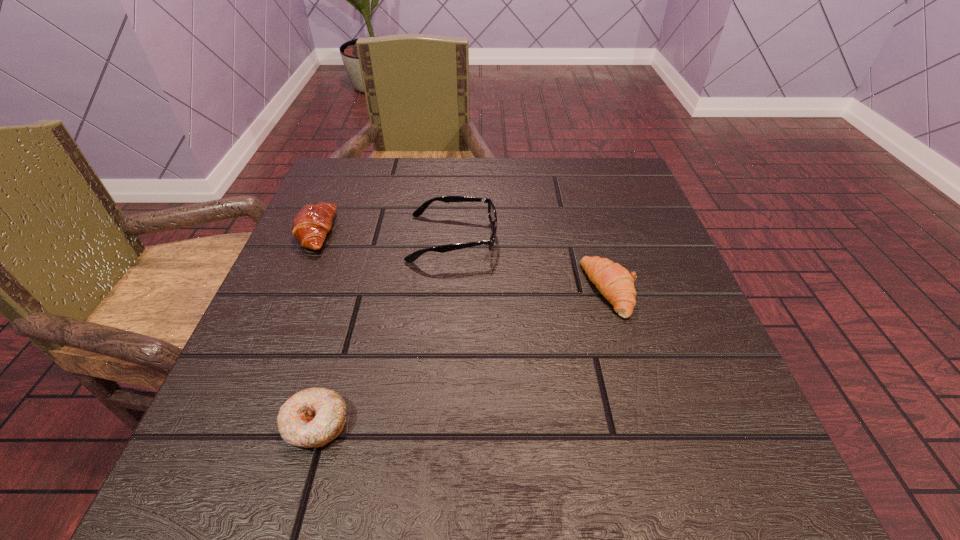
The image size is (960, 540). I want to click on blank area at the near edge, so click(575, 446).

You are a GUI agent. You are given a task and a screenshot of the screen. Output one action in this format:
    pyautogui.click(x=<x>, y=<y>)
    Task: Click on the blank space at the left edge
    This screenshot has height=540, width=960.
    Given the screenshot: What is the action you would take?
    pyautogui.click(x=333, y=245)

This screenshot has height=540, width=960. I want to click on free space at the right edge, so click(642, 312).

Identify the location of vacant space at the far left corner of the desktop. (390, 181).

In the image, there is a desktop. In order to click on free space at the near left corner in this screenshot , I will do `click(300, 489)`.

This screenshot has width=960, height=540. I want to click on free space at the far right corner of the desktop, so click(x=623, y=167).

The height and width of the screenshot is (540, 960). Identify the location of vacant region at the near right corner of the desktop. (717, 489).

Locate an element on the screen. Image resolution: width=960 pixels, height=540 pixels. free space between the nearer crescent roll and the doughnut is located at coordinates (464, 357).

This screenshot has width=960, height=540. I want to click on empty location between the right crescent roll and the spectacles, so click(x=532, y=264).

You are a GUI agent. You are given a task and a screenshot of the screen. Output one action in this format:
    pyautogui.click(x=<x>, y=<y>)
    Task: Click on the free space between the rightmost object and the leftmost object
    
    Given the screenshot: What is the action you would take?
    pyautogui.click(x=463, y=261)